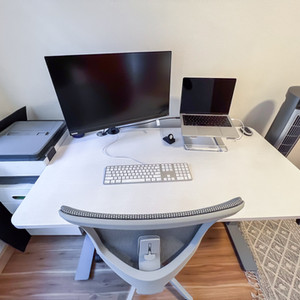
The height and width of the screenshot is (300, 300). In order to click on laptop in this screenshot , I will do `click(209, 127)`.